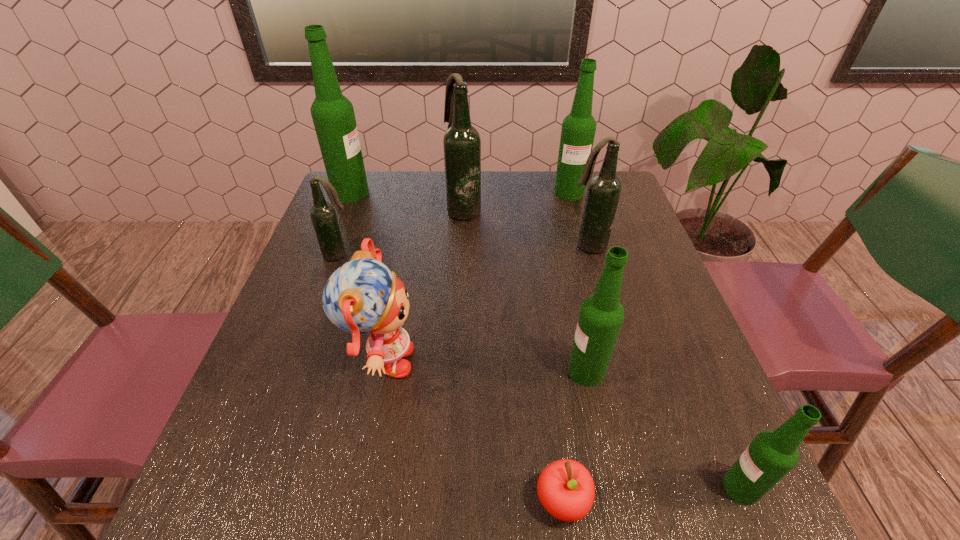
Find the location of a particular element. This screenshot has height=540, width=960. the rightmost green beer bottle is located at coordinates (771, 455).

The height and width of the screenshot is (540, 960). What are the coordinates of `the rightmost beer bottle` in the screenshot? It's located at (x=771, y=455).

At what (x,y) coordinates should I click in order to perform the action: click on red apple. Please return your answer as a coordinate pair (x, y). Looking at the image, I should click on (565, 488).

At what (x,y) coordinates should I click in order to perform the action: click on the shortest object. Please return your answer as a coordinate pair (x, y). This screenshot has width=960, height=540. Looking at the image, I should click on (565, 488).

You are a GUI agent. You are given a task and a screenshot of the screen. Output one action in this format:
    pyautogui.click(x=<x>, y=<y>)
    Task: Click on the free point located 0.290m on the label of the tallest object
    Image resolution: width=960 pixels, height=540 pixels.
    Given the screenshot: What is the action you would take?
    pyautogui.click(x=466, y=193)

Where is `vacant space located 0.250m on the label of the second biggest green beer bottle`? Image resolution: width=960 pixels, height=540 pixels. vacant space located 0.250m on the label of the second biggest green beer bottle is located at coordinates (587, 256).

You are a GUI agent. You are given a task and a screenshot of the screen. Output one action in this format:
    pyautogui.click(x=<x>, y=<y>)
    Task: Click on the free space located 0.340m on the front of the farthest dark beer bottle
    This screenshot has width=960, height=540.
    Given the screenshot: What is the action you would take?
    pyautogui.click(x=459, y=314)

What are the coordinates of `free space located 0.160m on the front of the second biggest dark beer bottle` in the screenshot? It's located at (602, 301).

Identify the location of vacant space located 0.290m on the label of the second nearest beer bottle. The height and width of the screenshot is (540, 960). pyautogui.click(x=419, y=371).

The height and width of the screenshot is (540, 960). In order to click on free space located 0.240m on the label of the second nearest beer bottle in this screenshot , I will do `click(444, 371)`.